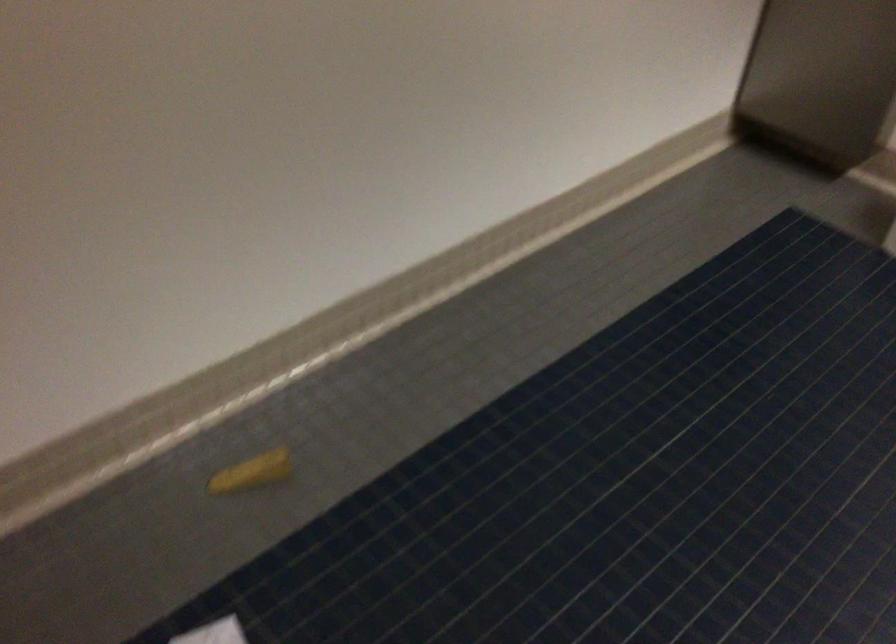
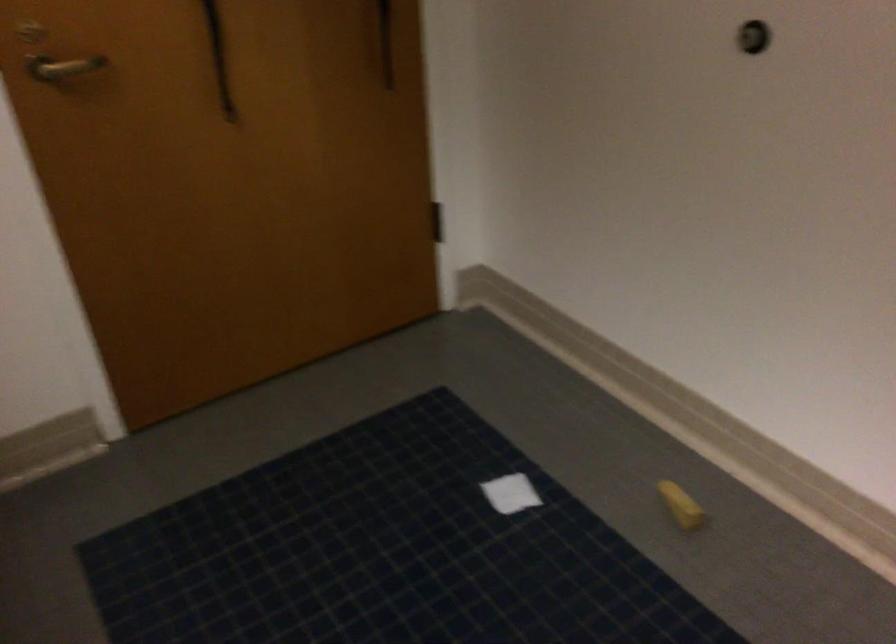
The point at (261, 473) is marked in the first image. Where is the corresponding point in the second image?

(681, 505)